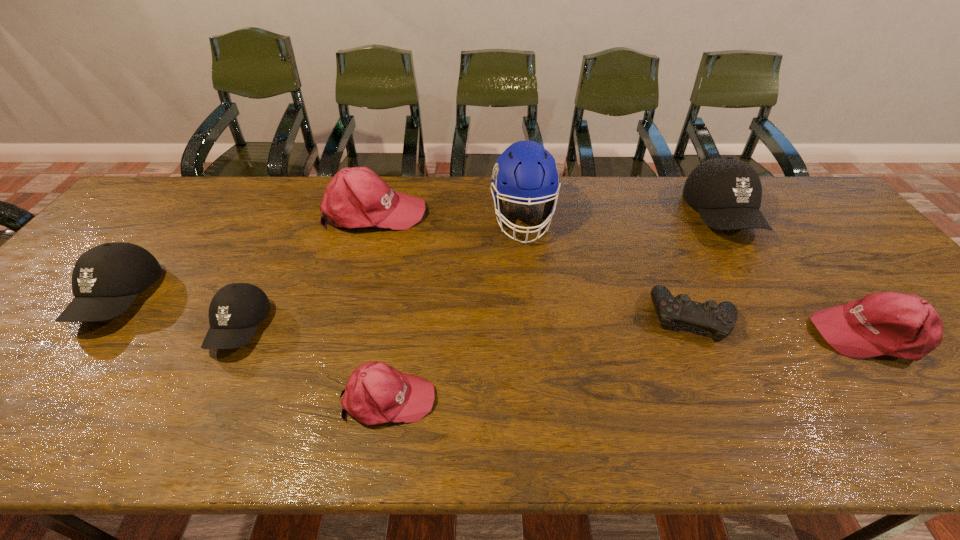
Identify the location of vacant space at the near edge. Image resolution: width=960 pixels, height=540 pixels. (26, 438).

The width and height of the screenshot is (960, 540). Find the location of `blank space at the right edge of the desktop`. blank space at the right edge of the desktop is located at coordinates [x=870, y=279].

I want to click on vacant space at the far left corner, so click(x=172, y=193).

Find the location of a particular element. Image resolution: width=960 pixels, height=540 pixels. vacant space at the far right corner is located at coordinates (798, 199).

The height and width of the screenshot is (540, 960). Find the location of `vacant area that lies between the tallest object and the biggest red baseball cap`. vacant area that lies between the tallest object and the biggest red baseball cap is located at coordinates (448, 215).

Locate an element on the screen. free space between the leftmost black baseball cap and the tallest object is located at coordinates (321, 259).

In order to click on vacant space that's between the blue football helmet and the sixth object from left to right in this screenshot , I will do `click(608, 268)`.

Image resolution: width=960 pixels, height=540 pixels. Identify the location of free space between the leftmost baseball cap and the control. (405, 308).

Where is `empty location between the nearest baseball cap and the rightmost black baseball cap`? This screenshot has height=540, width=960. empty location between the nearest baseball cap and the rightmost black baseball cap is located at coordinates (555, 307).

Where is `blank region between the leftmost black baseball cap and the biggest black baseball cap`? blank region between the leftmost black baseball cap and the biggest black baseball cap is located at coordinates (420, 257).